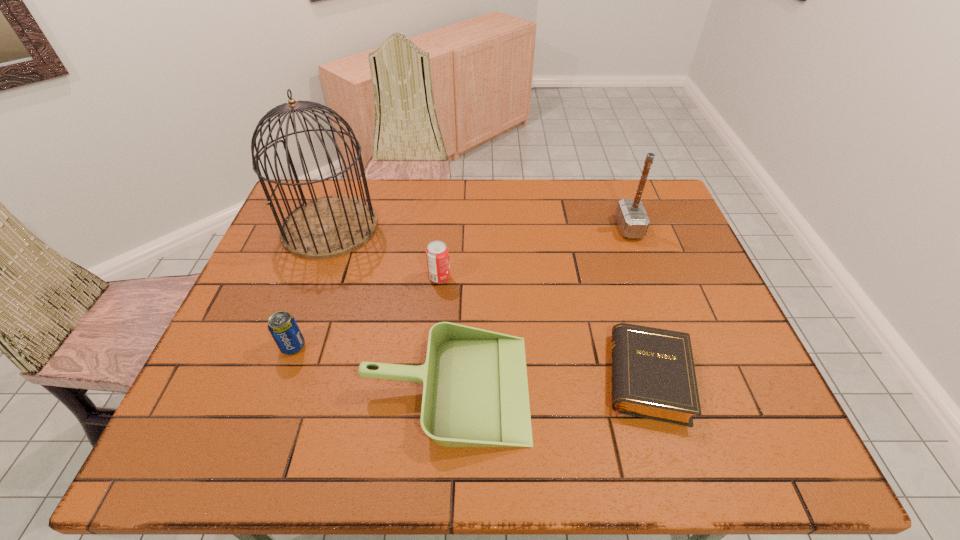
Where is `free space between the fourth nearest object and the Bible`? The height and width of the screenshot is (540, 960). free space between the fourth nearest object and the Bible is located at coordinates (543, 327).

Locate an element on the screen. This screenshot has width=960, height=540. object identified as the closest to the fifth tallest object is located at coordinates (283, 327).

Locate an element on the screen. This screenshot has width=960, height=540. object identified as the second closest to the right soda is located at coordinates (331, 226).

Where is `free space in the image that satisfies the following two spatial constraints: 1. at the door of the shortest object; 2. on the left side of the tallest object`? This screenshot has height=540, width=960. free space in the image that satisfies the following two spatial constraints: 1. at the door of the shortest object; 2. on the left side of the tallest object is located at coordinates (275, 376).

This screenshot has height=540, width=960. I want to click on vacant space that satisfies the following two spatial constraints: 1. on the front side of the left soda; 2. on the left side of the shortest object, so click(x=282, y=376).

This screenshot has width=960, height=540. Identify the location of vacant region that satisfies the following two spatial constraints: 1. at the door of the tallest object; 2. on the right side of the nearer soda. (286, 346).

Locate an element on the screen. vacant space that satisfies the following two spatial constraints: 1. at the door of the birdcage; 2. on the left side of the Bible is located at coordinates (275, 376).

Where is `vacant area in the image that satisfies the following two spatial constraints: 1. on the striking surface of the fifth shortest object; 2. on the front side of the fourth nearest object`? vacant area in the image that satisfies the following two spatial constraints: 1. on the striking surface of the fifth shortest object; 2. on the front side of the fourth nearest object is located at coordinates (647, 278).

This screenshot has height=540, width=960. What are the coordinates of `vacant region that satisfies the following two spatial constraints: 1. at the door of the birdcage; 2. on the right side of the shortest object` in the screenshot? It's located at (275, 376).